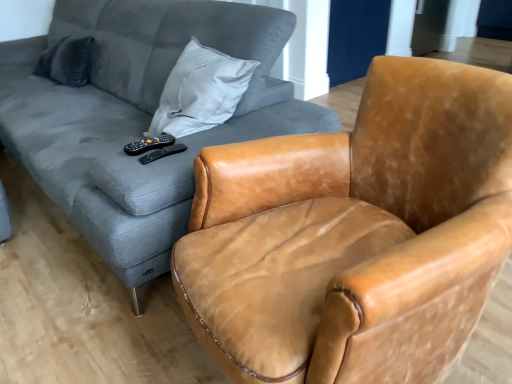
Question: Can you confirm if matte gray fabric couch at upper left is positioned to the left of black matte remote at center, which is the 1th remote from right to left?

Choices:
 (A) yes
 (B) no

Answer: (A)

Question: Is matte gray fabric couch at upper left surrounding black matte remote at center, which is the 1th remote from right to left?

Choices:
 (A) no
 (B) yes

Answer: (B)

Question: Considering the relative sizes of matte gray fabric couch at upper left and black matte remote at center, which is the 1th remote from right to left, in the image provided, is matte gray fabric couch at upper left shorter than black matte remote at center, which is the 1th remote from right to left,?

Choices:
 (A) yes
 (B) no

Answer: (B)

Question: Is matte gray fabric couch at upper left facing away from black matte remote at center, which is the 1th remote from right to left?

Choices:
 (A) no
 (B) yes

Answer: (A)

Question: From a real-world perspective, is matte gray fabric couch at upper left over black matte remote at center, which is the 1th remote from right to left?

Choices:
 (A) yes
 (B) no

Answer: (B)

Question: From the image's perspective, is matte gray fabric couch at upper left located above black matte remote at center, which is the 1th remote from right to left?

Choices:
 (A) yes
 (B) no

Answer: (A)

Question: Can you confirm if black plastic remote at center, which is the second remote from right to left, is thinner than leather armchair at center?

Choices:
 (A) no
 (B) yes

Answer: (B)

Question: Is black plastic remote at center, marked as the 1th remote in a left-to-right arrangement, to the left of leather armchair at center from the viewer's perspective?

Choices:
 (A) no
 (B) yes

Answer: (B)

Question: Is black plastic remote at center, marked as the 1th remote in a left-to-right arrangement, aimed at leather armchair at center?

Choices:
 (A) no
 (B) yes

Answer: (A)

Question: Can you confirm if black plastic remote at center, which is the second remote from right to left, is positioned to the right of leather armchair at center?

Choices:
 (A) yes
 (B) no

Answer: (B)

Question: Considering the relative sizes of black plastic remote at center, which is the second remote from right to left, and leather armchair at center in the image provided, is black plastic remote at center, which is the second remote from right to left, bigger than leather armchair at center?

Choices:
 (A) yes
 (B) no

Answer: (B)

Question: Is leather armchair at center completely or partially inside black plastic remote at center, marked as the 1th remote in a left-to-right arrangement?

Choices:
 (A) no
 (B) yes

Answer: (A)

Question: Is leather armchair at center behind dark gray fabric pillow at upper left?

Choices:
 (A) no
 (B) yes

Answer: (A)